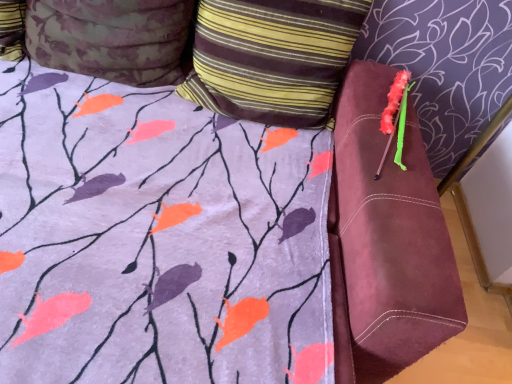
Question: Which direction should I rotate to face striped fabric pillow at upper center, marked as the first pillow in a right-to-left arrangement, — up or down?

Choices:
 (A) down
 (B) up

Answer: (B)

Question: Is striped fabric pillow at upper center, marked as the first pillow in a right-to-left arrangement, inside floral fabric pillow at upper left, arranged as the 1th pillow when viewed from the left?

Choices:
 (A) no
 (B) yes

Answer: (A)

Question: From the image's perspective, does floral fabric pillow at upper left, arranged as the 1th pillow when viewed from the left, appear higher than striped fabric pillow at upper center, marked as the first pillow in a right-to-left arrangement?

Choices:
 (A) no
 (B) yes

Answer: (B)

Question: Does floral fabric pillow at upper left, arranged as the 1th pillow when viewed from the left, lie behind striped fabric pillow at upper center, marked as the first pillow in a right-to-left arrangement?

Choices:
 (A) yes
 (B) no

Answer: (B)

Question: Is the depth of floral fabric pillow at upper left, which is the second pillow in right-to-left order, less than that of striped fabric pillow at upper center, arranged as the second pillow when viewed from the left?

Choices:
 (A) yes
 (B) no

Answer: (A)

Question: Is floral fabric pillow at upper left, arranged as the 1th pillow when viewed from the left, positioned far away from striped fabric pillow at upper center, marked as the first pillow in a right-to-left arrangement?

Choices:
 (A) no
 (B) yes

Answer: (A)

Question: Can you confirm if floral fabric pillow at upper left, which is the second pillow in right-to-left order, is thinner than striped fabric pillow at upper center, arranged as the second pillow when viewed from the left?

Choices:
 (A) no
 (B) yes

Answer: (A)

Question: Can you confirm if fluffy pink brush at upper right is bigger than striped fabric pillow at upper center, marked as the first pillow in a right-to-left arrangement?

Choices:
 (A) yes
 (B) no

Answer: (B)

Question: Is fluffy pink brush at upper right positioned in front of striped fabric pillow at upper center, marked as the first pillow in a right-to-left arrangement?

Choices:
 (A) yes
 (B) no

Answer: (B)

Question: Can you confirm if fluffy pink brush at upper right is thinner than striped fabric pillow at upper center, arranged as the second pillow when viewed from the left?

Choices:
 (A) no
 (B) yes

Answer: (A)

Question: From the image's perspective, would you say fluffy pink brush at upper right is positioned over striped fabric pillow at upper center, marked as the first pillow in a right-to-left arrangement?

Choices:
 (A) no
 (B) yes

Answer: (A)

Question: Does fluffy pink brush at upper right have a greater height compared to striped fabric pillow at upper center, arranged as the second pillow when viewed from the left?

Choices:
 (A) yes
 (B) no

Answer: (B)

Question: From the image's perspective, is fluffy pink brush at upper right beneath striped fabric pillow at upper center, arranged as the second pillow when viewed from the left?

Choices:
 (A) yes
 (B) no

Answer: (A)

Question: Is fluffy pink brush at upper right with floral fabric pillow at upper left, arranged as the 1th pillow when viewed from the left?

Choices:
 (A) yes
 (B) no

Answer: (B)